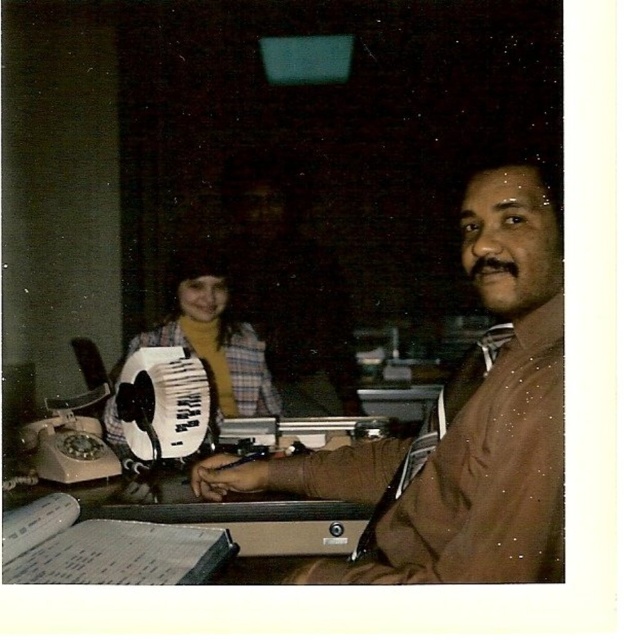
Between brown smooth shirt at right and plaid fabric accordion at center, which one has more height?

brown smooth shirt at right

Locate an element on the screen. The width and height of the screenshot is (624, 640). brown smooth shirt at right is located at coordinates (461, 422).